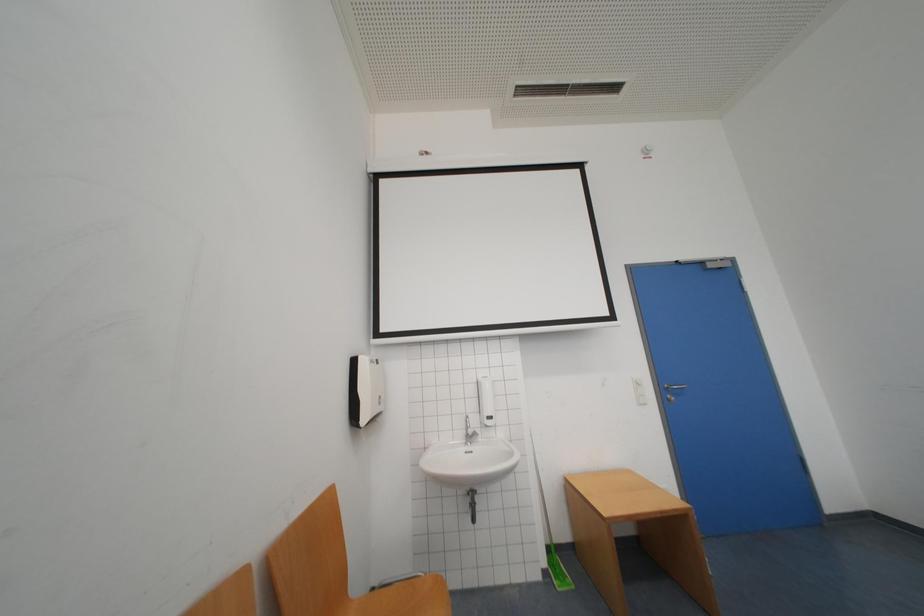
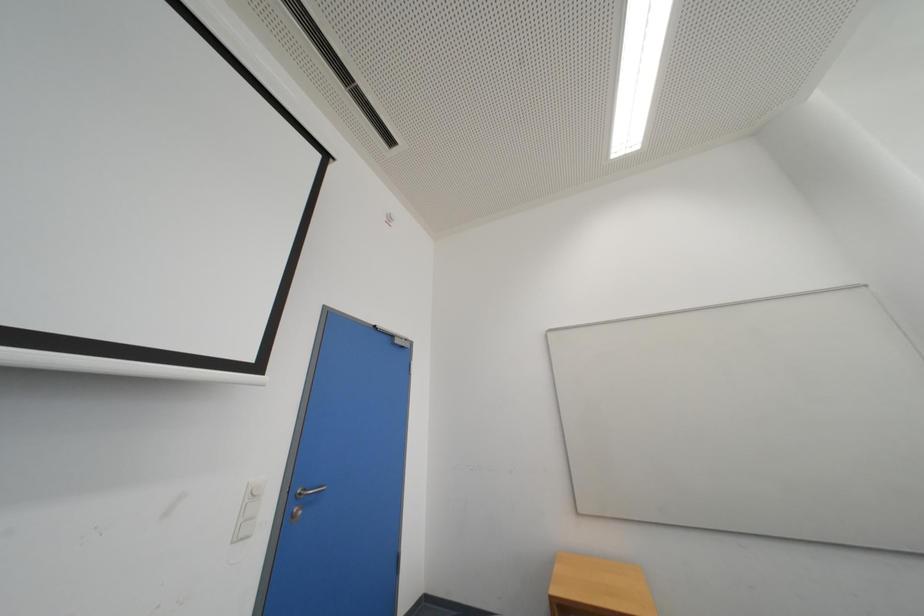
How did the camera likely rotate?

The rotation direction of the camera is right-up.